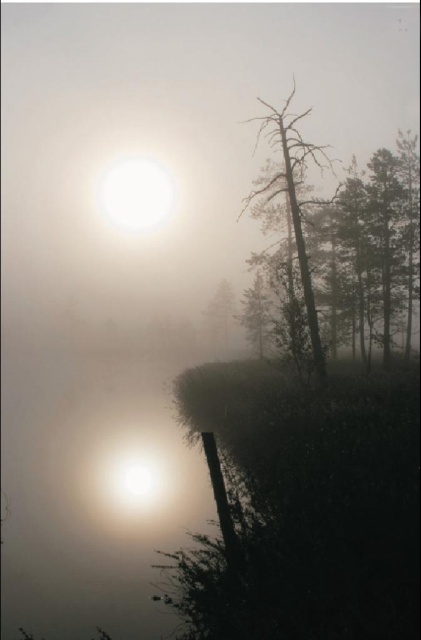
Can you confirm if brown textured tree at right is wider than smooth green tree at center?

Yes, brown textured tree at right is wider than smooth green tree at center.

Consider the image. Does brown textured tree at right have a lesser height compared to smooth green tree at center?

No.

This screenshot has width=421, height=640. I want to click on brown textured tree at right, so click(x=293, y=196).